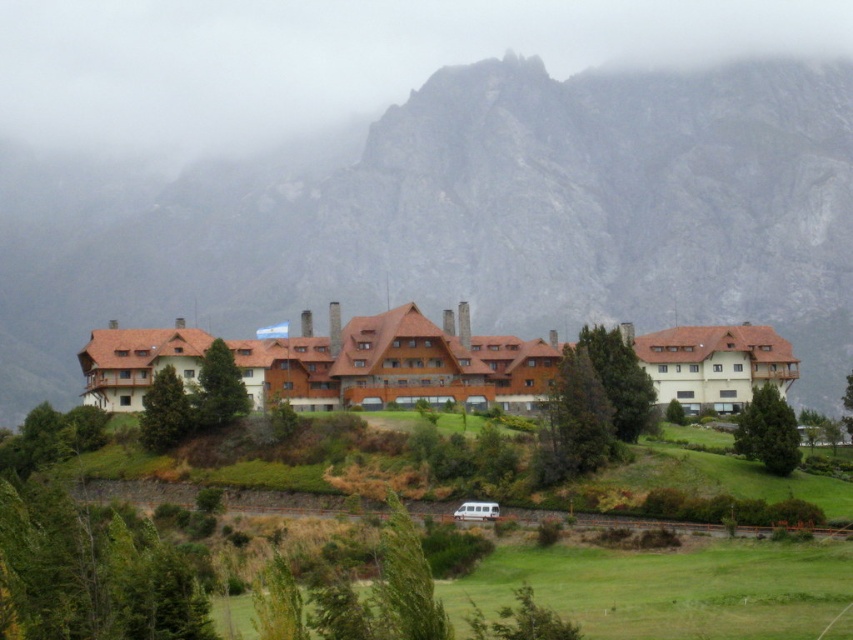
Which is behind, point (221, 224) or point (228, 3)?

The point (228, 3) is more distant.

In the scene shown: Between rugged stone mountain at center and foggy rock at upper center, which one appears on the left side from the viewer's perspective?

foggy rock at upper center

Locate an element on the screen. rugged stone mountain at center is located at coordinates (486, 220).